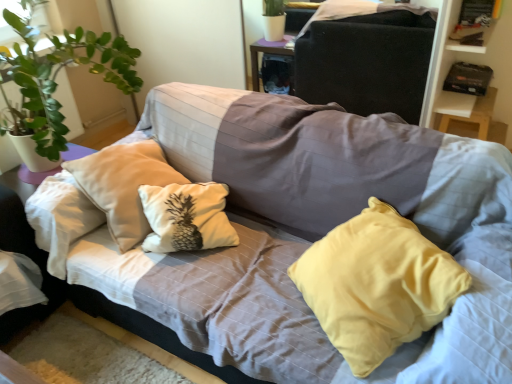
Question: From the image's perspective, relative to black cardboard box at upper right, is yellow fabric pillow at center above or below?

Choices:
 (A) below
 (B) above

Answer: (A)

Question: Is yellow fabric pillow at center situated inside black cardboard box at upper right or outside?

Choices:
 (A) inside
 (B) outside

Answer: (B)

Question: Which is farther from the yellow fabric pillow at center?

Choices:
 (A) matte fabric couch at upper center
 (B) black cardboard box at upper right

Answer: (A)

Question: Which of these objects is positioned farthest from the black cardboard box at upper right?

Choices:
 (A) yellow fabric pillow at center
 (B) matte fabric couch at upper center

Answer: (A)